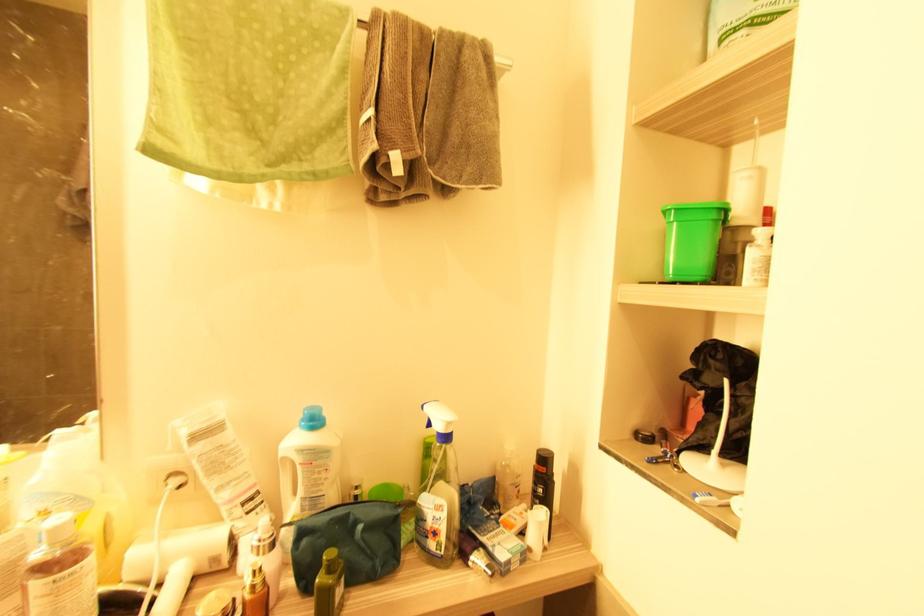
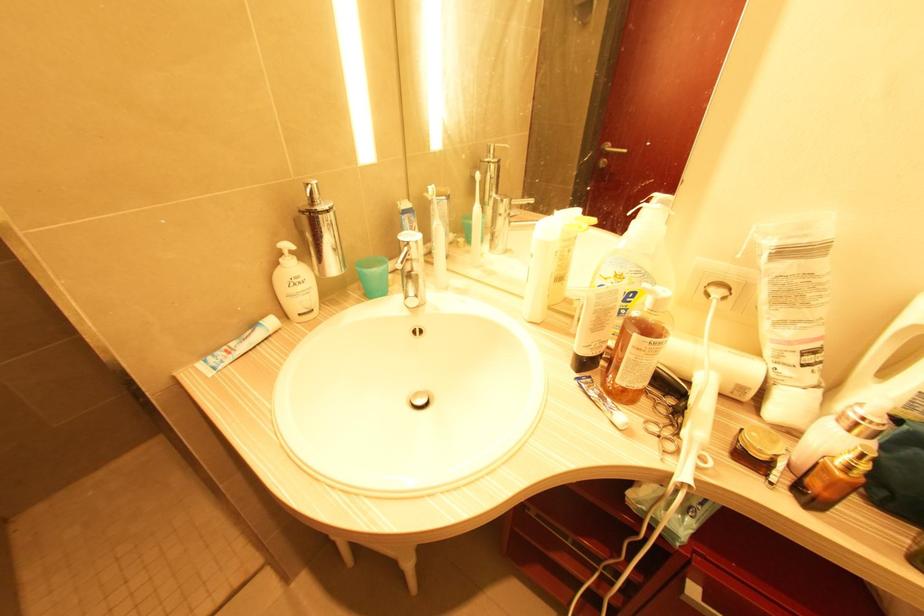
In the second image, find the point that corresponds to (254,588) in the first image.

(850, 468)